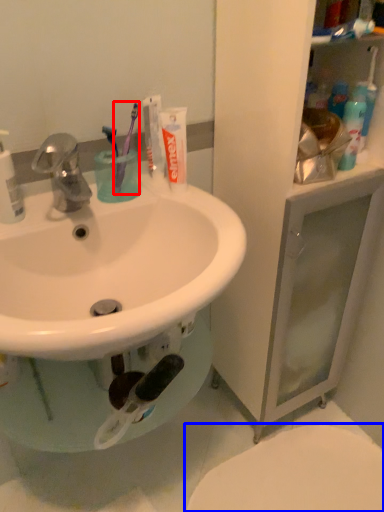
Question: Which object is further to the camera taking this photo, toothbrush (highlighted by a red box) or toilet (highlighted by a blue box)?

Choices:
 (A) toothbrush
 (B) toilet

Answer: (B)